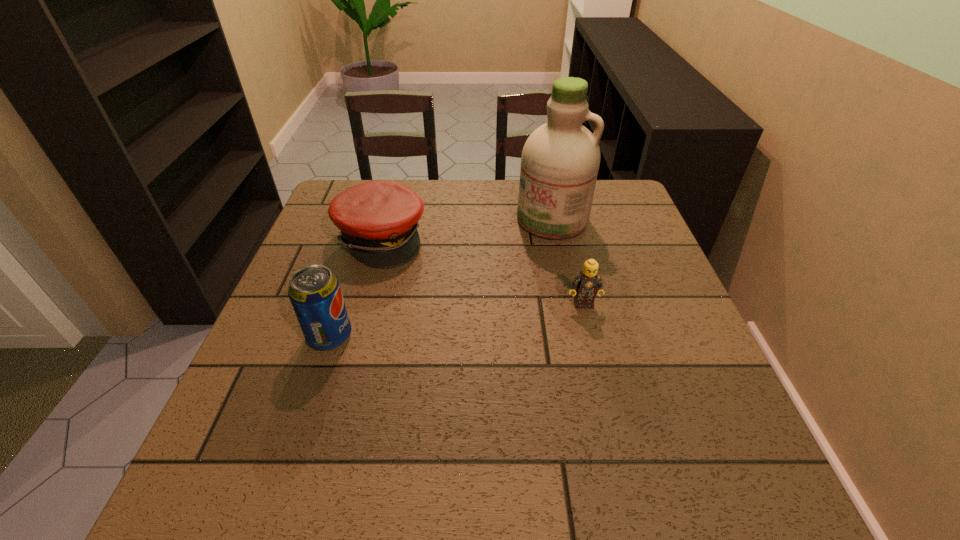
Find the location of a particular element. The image size is (960, 540). free spot on the desktop that is between the nearest object and the Lego and is positioned on the front label of the cleansing agent is located at coordinates (488, 316).

This screenshot has width=960, height=540. In order to click on vacant space on the desktop that is between the nearest object and the Lego and is positioned on the front of the cap with an emblem in this screenshot , I will do `click(498, 315)`.